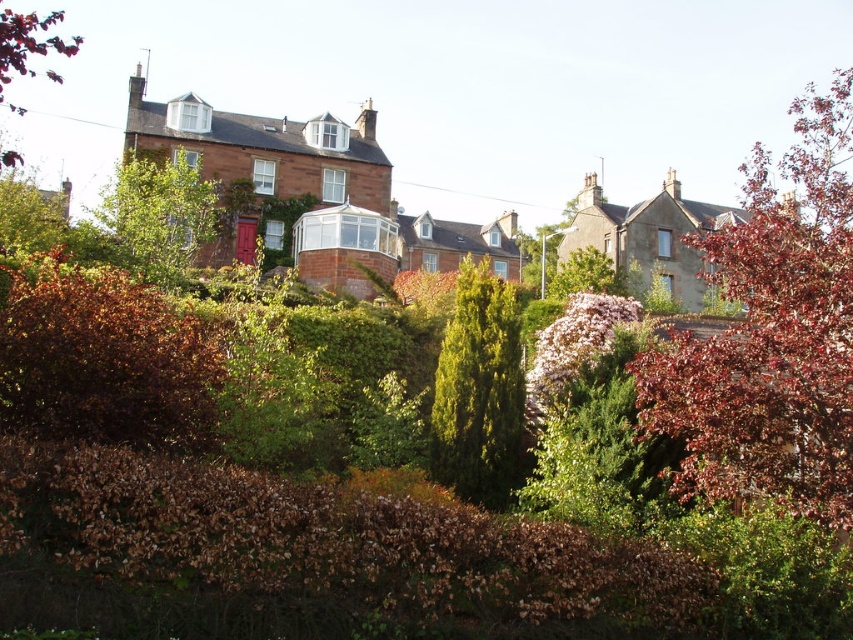
Question: Is green leafy tree at center bigger than smooth brown tree at upper left?

Choices:
 (A) no
 (B) yes

Answer: (A)

Question: Which point is closer to the camera taking this photo?

Choices:
 (A) (19, 108)
 (B) (801, 452)
 (C) (468, 317)
 (D) (177, 224)

Answer: (B)

Question: Which point appears closest to the camera in this image?

Choices:
 (A) (744, 289)
 (B) (78, 38)

Answer: (A)

Question: Among these points, which one is farthest from the camera?

Choices:
 (A) (173, 150)
 (B) (24, 76)
 (C) (437, 362)
 (D) (838, 163)

Answer: (B)

Question: Can you confirm if green leafy tree at center is positioned to the left of smooth brown tree at upper left?

Choices:
 (A) yes
 (B) no

Answer: (B)

Question: Does green textured tree at center have a lesser width compared to smooth brown tree at upper left?

Choices:
 (A) yes
 (B) no

Answer: (A)